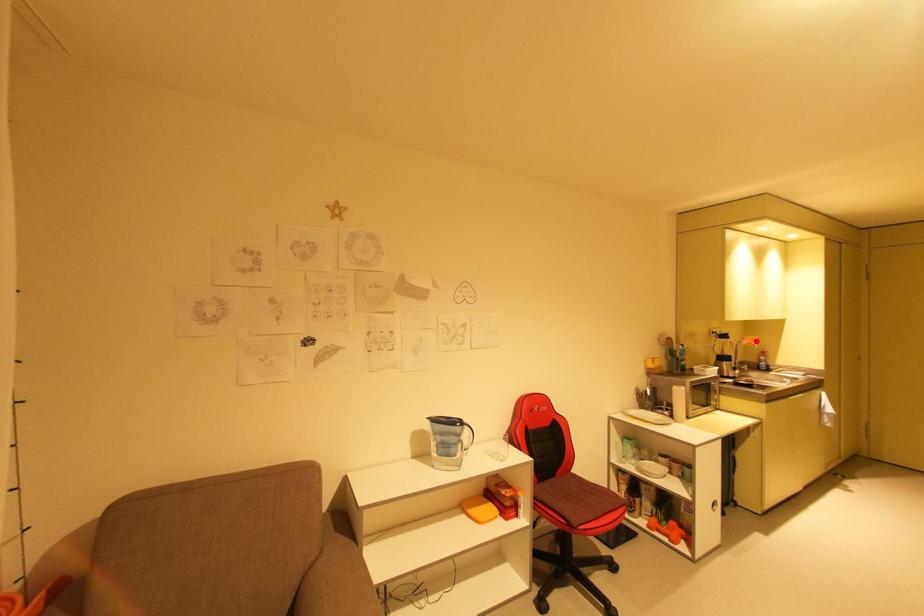
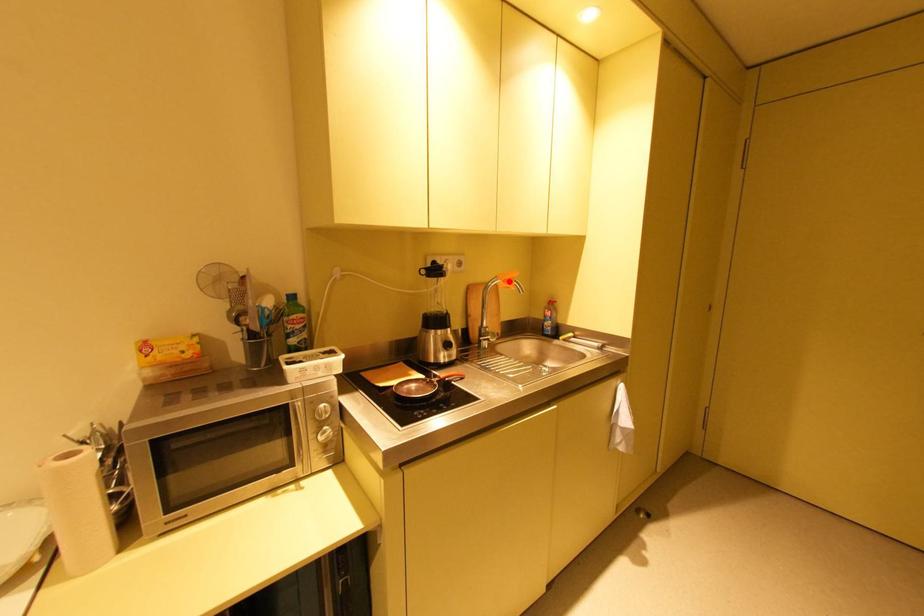
I am providing you with two images of the same scene from different viewpoints. A red point is marked on the first image and another point is marked on the second image. Is the red point in image1 aligned with the point shown in image2?

Yes